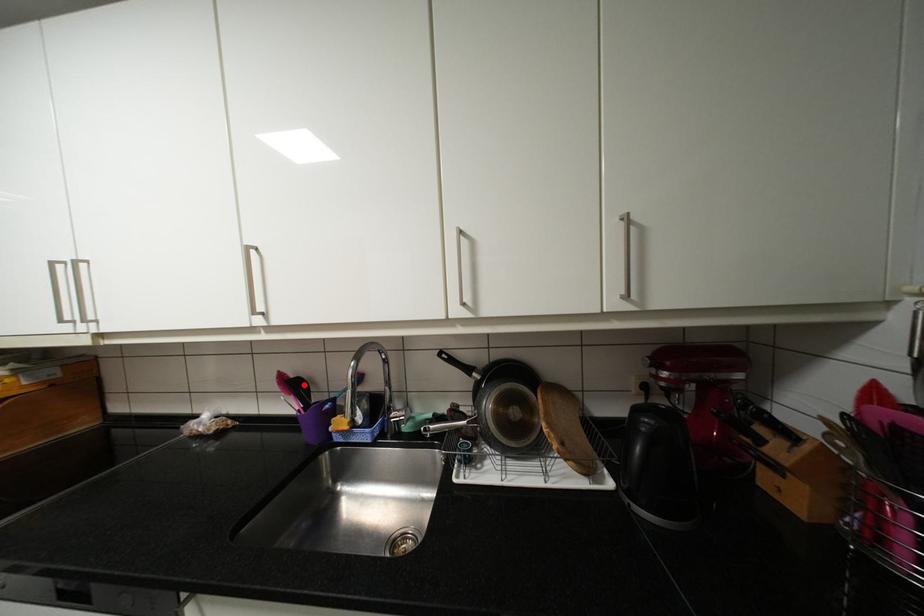
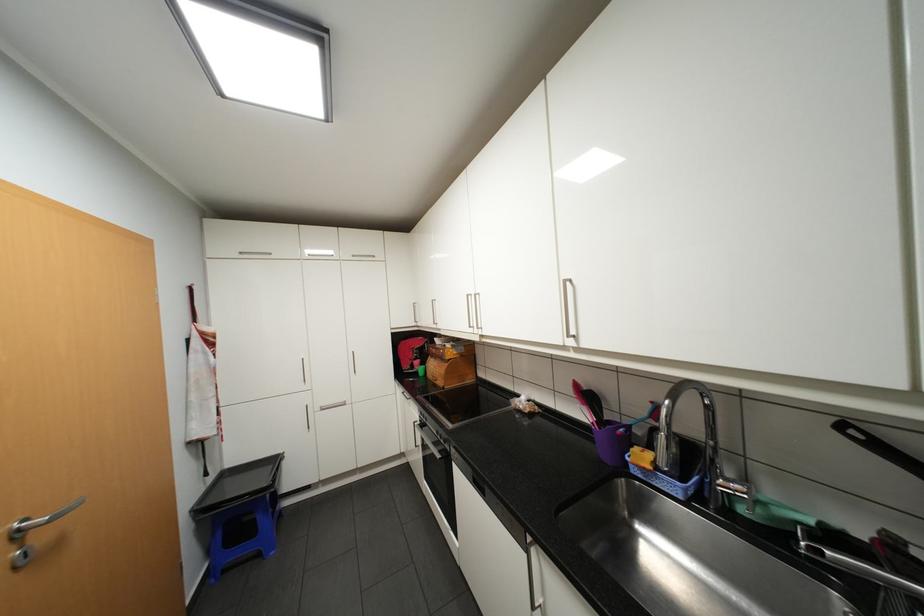
In the second image, find the point that corresponds to the highlighted location in the first image.

(597, 397)